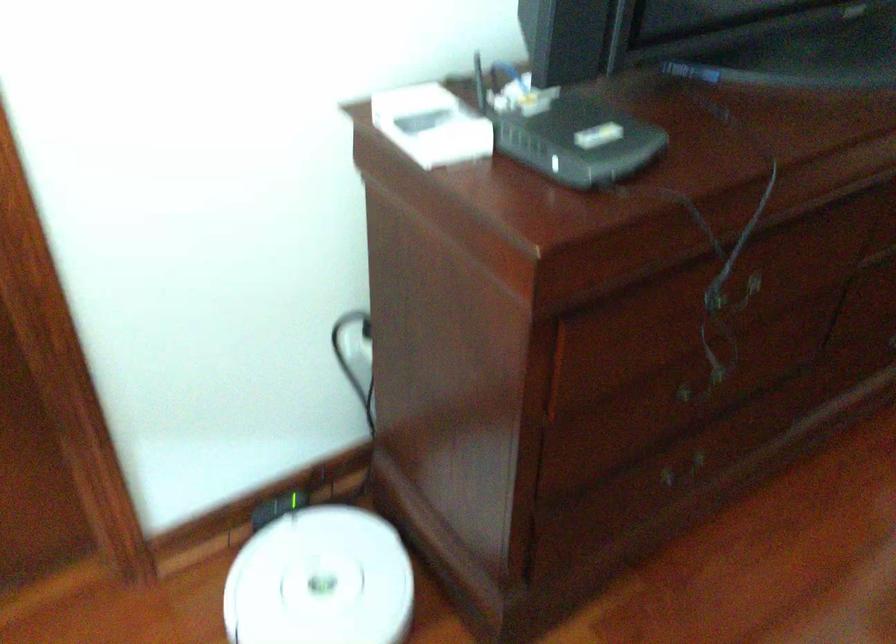
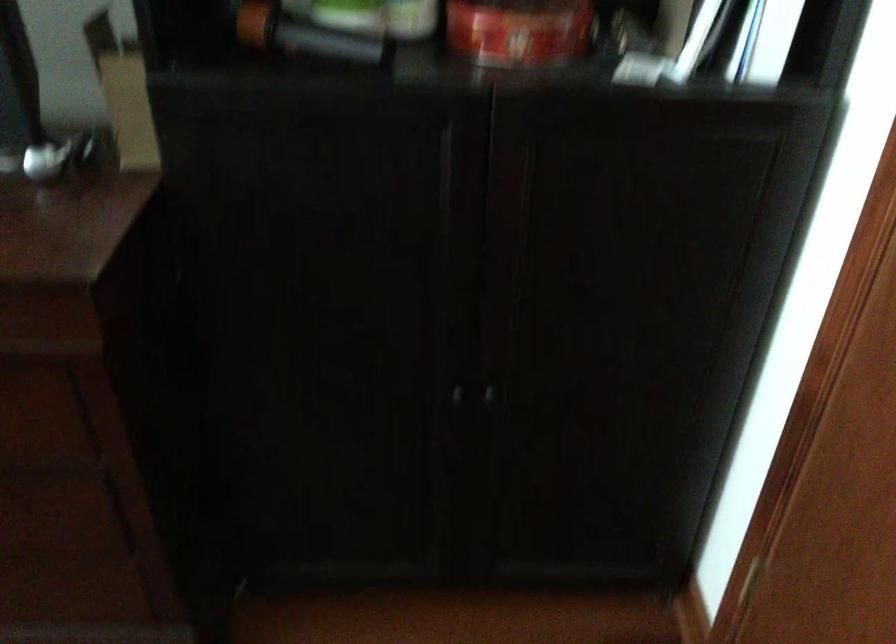
The images are taken continuously from a first-person perspective. In which direction are you moving?

The movement direction of the cameraman is right, forward.